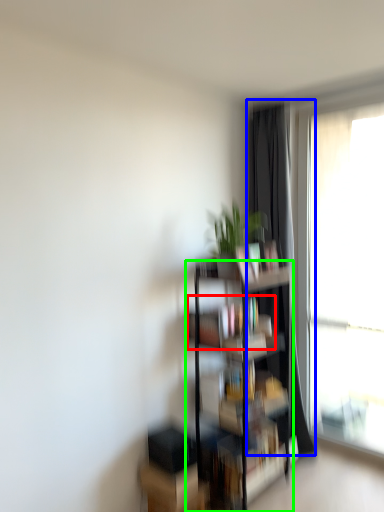
Question: Considering the real-world distances, which object is farthest from book (highlighted by a red box)? curtain (highlighted by a blue box) or shelf (highlighted by a green box)?

Choices:
 (A) curtain
 (B) shelf

Answer: (A)